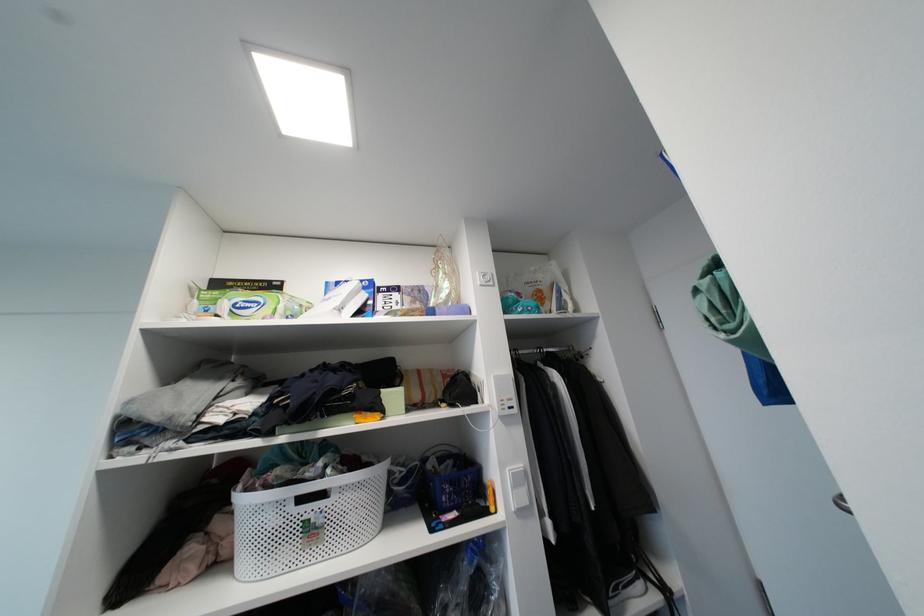
Find where to pull the white basket handle. Please return your answer as a coordinate pair (x, y).

(310, 496)